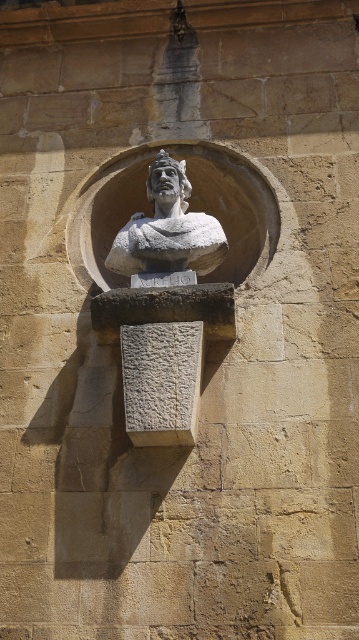
Question: Is white stone bust at center positioned behind matte stone bust at center?

Choices:
 (A) yes
 (B) no

Answer: (B)

Question: Which of the following is the farthest from the observer?

Choices:
 (A) matte stone bust at center
 (B) white stone bust at center

Answer: (A)

Question: Observing the image, what is the correct spatial positioning of white stone bust at center in reference to matte stone bust at center?

Choices:
 (A) above
 (B) below

Answer: (B)

Question: Does white stone bust at center appear on the left side of matte stone bust at center?

Choices:
 (A) no
 (B) yes

Answer: (B)